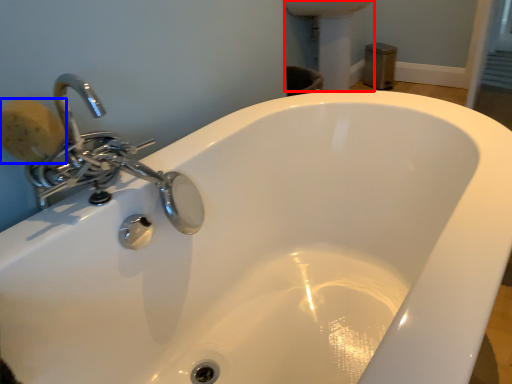
Question: Which object appears farthest to the camera in this image, porcelain (highlighted by a red box) or soap (highlighted by a blue box)?

Choices:
 (A) porcelain
 (B) soap

Answer: (A)